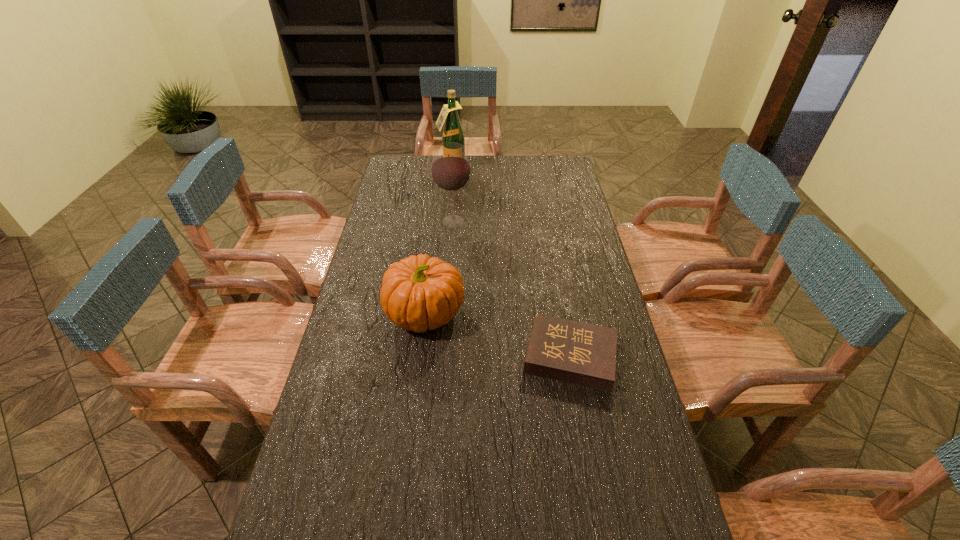
This screenshot has width=960, height=540. What are the coordinates of `vacant area that lies between the shortest object and the liquor` in the screenshot? It's located at (511, 265).

Locate an element on the screen. vacant space that is in between the rightmost object and the pumpkin is located at coordinates click(498, 335).

Where is `the closest object relative to the alcohol`? the closest object relative to the alcohol is located at coordinates (452, 132).

Find the location of a particular element. object that is the second closest to the liquor is located at coordinates (418, 293).

The image size is (960, 540). In order to click on vacant region that satisfies the following two spatial constraints: 1. on the front side of the third nearest object; 2. on the left side of the hardback book in this screenshot , I will do `click(444, 356)`.

The width and height of the screenshot is (960, 540). What are the coordinates of `vacant area that satisfies the following two spatial constraints: 1. on the front-facing side of the liquor; 2. on the surface of the pumpkin` in the screenshot? It's located at (440, 313).

This screenshot has height=540, width=960. Identify the location of free location that satisfies the following two spatial constraints: 1. on the surface of the second shortest object; 2. on the back side of the shortest object. (420, 356).

The width and height of the screenshot is (960, 540). Identify the location of blank space that satisfies the following two spatial constraints: 1. on the surface of the pumpkin; 2. on the right side of the hardback book. (420, 356).

Identify the location of vacant space that satisfies the following two spatial constraints: 1. on the front-facing side of the tallest object; 2. on the surface of the pumpkin. (440, 313).

Locate an element on the screen. The width and height of the screenshot is (960, 540). vacant region that satisfies the following two spatial constraints: 1. on the front-facing side of the shortest object; 2. on the right side of the liquor is located at coordinates (435, 356).